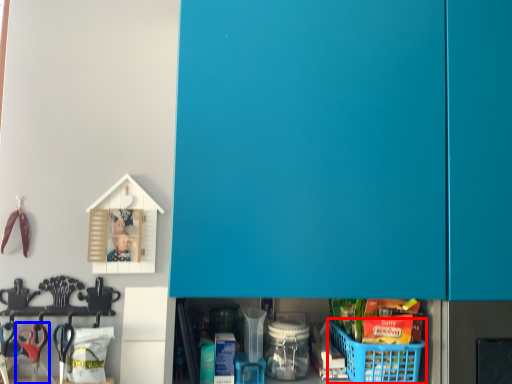
Question: Which point is further to the camera, basket (highlighted by a red box) or scissors (highlighted by a blue box)?

Choices:
 (A) basket
 (B) scissors

Answer: (B)